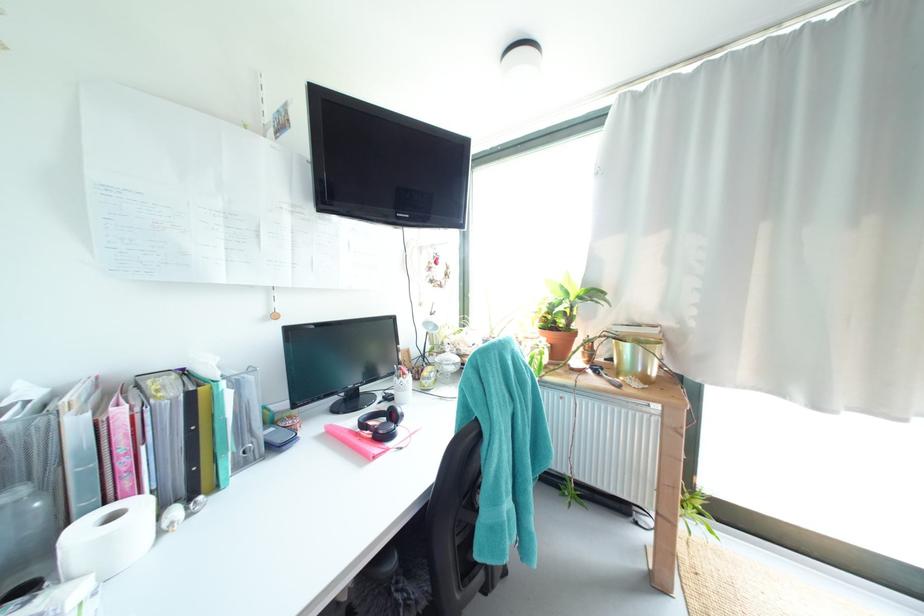
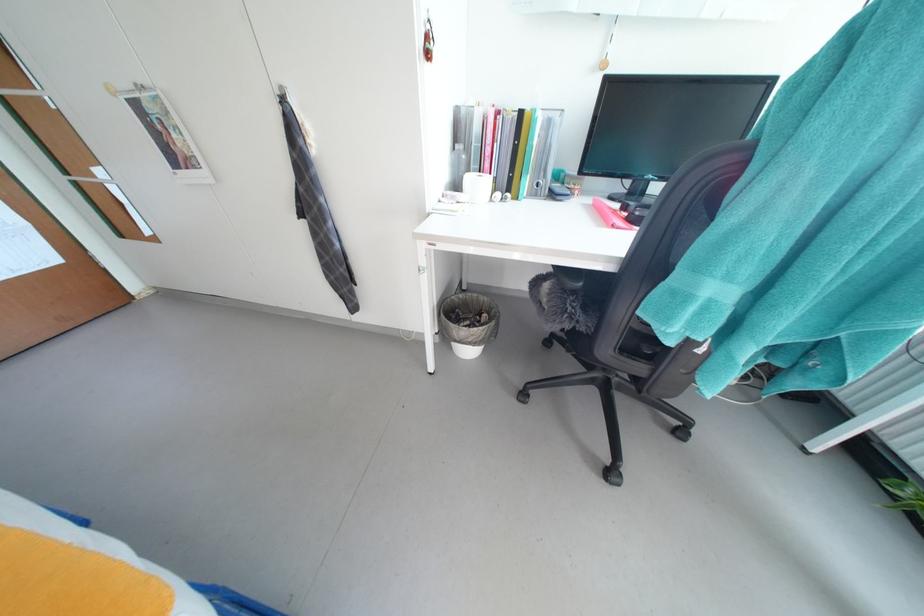
Find the pixel in the second image that matches pixel 201 479 in the first image.

(517, 183)